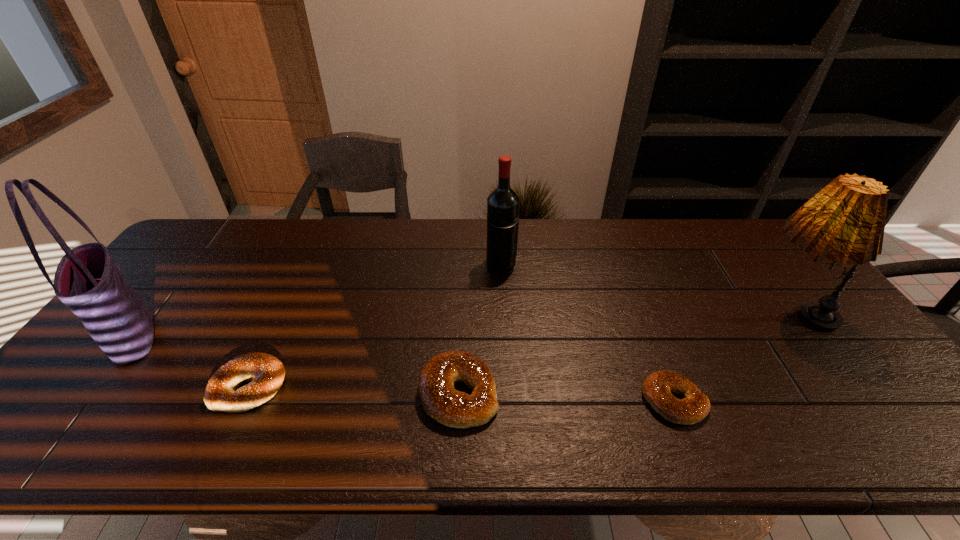
I want to click on free region at the near edge of the desktop, so click(171, 403).

This screenshot has height=540, width=960. In order to click on free space at the left edge of the desktop in this screenshot , I will do `click(175, 320)`.

Image resolution: width=960 pixels, height=540 pixels. I want to click on free space at the right edge of the desktop, so click(788, 300).

Locate an element on the screen. The width and height of the screenshot is (960, 540). vacant space at the far left corner of the desktop is located at coordinates (179, 248).

Image resolution: width=960 pixels, height=540 pixels. Find the location of `vacant space at the near right corner`. vacant space at the near right corner is located at coordinates (898, 413).

Find the location of `vacant space that's between the second shortest object and the farthest object`. vacant space that's between the second shortest object and the farthest object is located at coordinates (375, 325).

Where is `free space between the fifth object from left to right and the second bagel from right to left`? The height and width of the screenshot is (540, 960). free space between the fifth object from left to right and the second bagel from right to left is located at coordinates (566, 397).

Where is `vacant space in between the rightmost object and the leftmost bagel`? vacant space in between the rightmost object and the leftmost bagel is located at coordinates (519, 349).

Where is `vacant space that's between the tote bag and the wine bottle`? This screenshot has height=540, width=960. vacant space that's between the tote bag and the wine bottle is located at coordinates (317, 301).

Find the location of `free space that is in between the shortest object and the tote bag`. free space that is in between the shortest object and the tote bag is located at coordinates (403, 369).